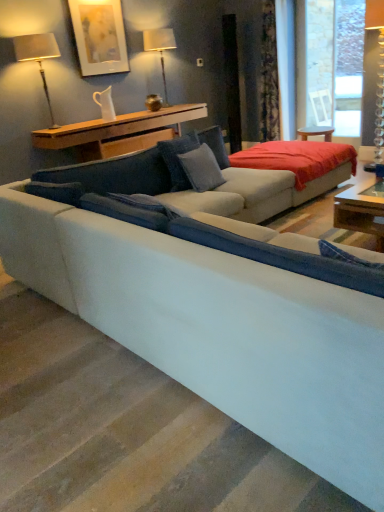
Question: Is wooden shelf at upper center taller or shorter than suede-like blue pillow at center, the first pillow from the left?

Choices:
 (A) tall
 (B) short

Answer: (B)

Question: Considering their positions, is wooden shelf at upper center located in front of or behind suede-like blue pillow at center, which is the second pillow in right-to-left order?

Choices:
 (A) behind
 (B) front

Answer: (A)

Question: Estimate the real-world distances between objects in this image. Which object is closer to the matte white lampshade at upper center, placed as the 2th table lamp when sorted from front to back?

Choices:
 (A) suede-like blue pillow at center, the first pillow from the left
 (B) blue fabric pillow at center, positioned as the first pillow in right-to-left order
 (C) matte silver table lamp at upper left, which ranks as the 1th table lamp in left-to-right order
 (D) wooden shelf at upper center
 (E) matte white picture frame at upper left

Answer: (E)

Question: Based on their relative distances, which object is nearer to the matte silver table lamp at upper left, which ranks as the 1th table lamp in left-to-right order?

Choices:
 (A) matte white lampshade at upper center, which is counted as the first table lamp, starting from the back
 (B) wooden shelf at upper center
 (C) matte white picture frame at upper left
 (D) blue fabric pillow at center, positioned as the first pillow in right-to-left order
 (E) suede-like blue pillow at center, the first pillow from the left

Answer: (C)